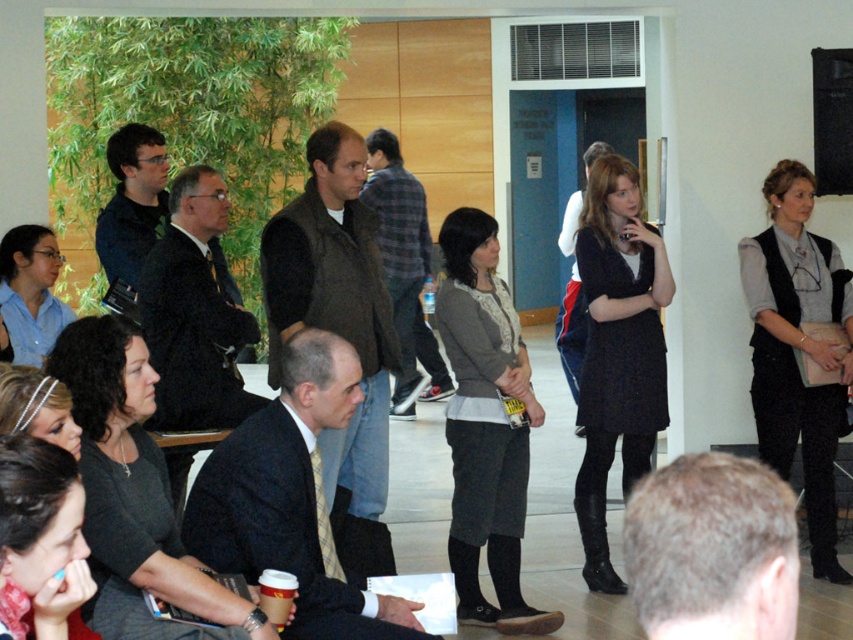
You are standing in the room and want to place a small plant between the two points, point (338, 353) and point (822, 269). Which point should the plant be closer to in order to be at the same depth as the wooden wall?

The plant should be closer to point (822, 269) because point (338, 353) is closer to the camera than point (822, 269). Since the wooden wall is in the background, aligning the plant with the farther point would place it at the same depth as the wooden wall.

From the picture: You are organizing a photo shoot and need to know which piece of clothing takes up more visual space in the image. Based on the scene description, which between the dark suit at center and the gray wool vest at upper right is larger in size?

The gray wool vest at upper right occupies more visual space than the dark suit at center according to the description.